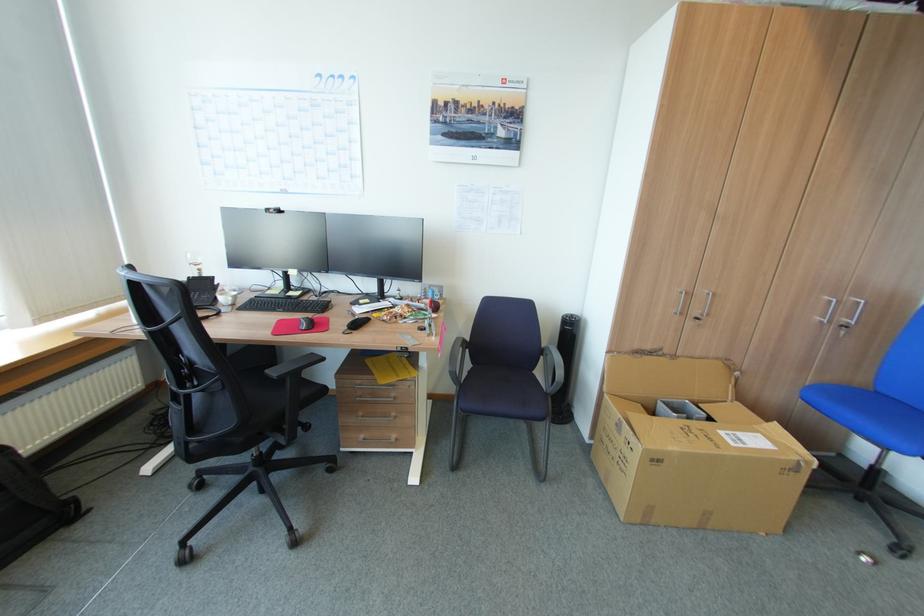
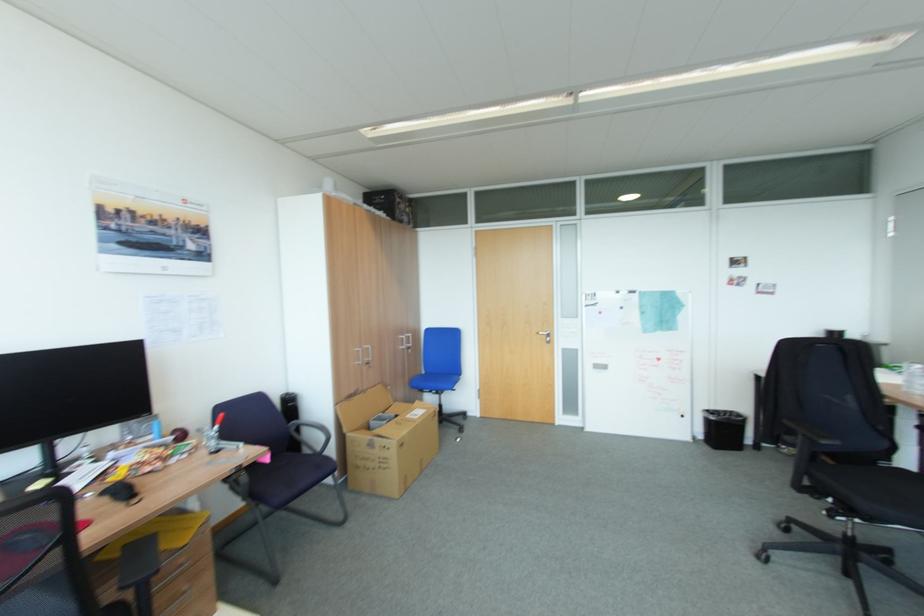
In the second image, find the point that corresponds to the point at 772,421 in the first image.

(419, 403)